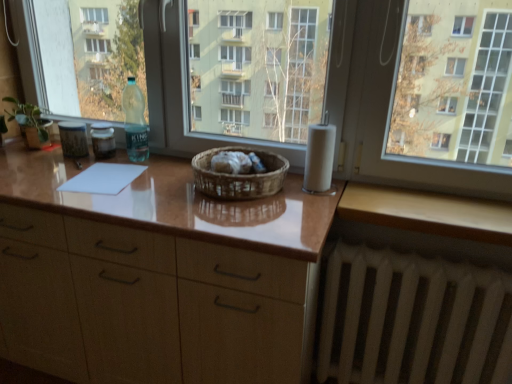
Question: Should I look upward or downward to see woven brown basket at center?

Choices:
 (A) down
 (B) up

Answer: (B)

Question: From a real-world perspective, is white matte toilet paper at right beneath green matte plant at left?

Choices:
 (A) no
 (B) yes

Answer: (B)

Question: Can you confirm if white matte toilet paper at right is wider than green matte plant at left?

Choices:
 (A) yes
 (B) no

Answer: (B)

Question: Would you say white matte toilet paper at right is a long distance from green matte plant at left?

Choices:
 (A) yes
 (B) no

Answer: (A)

Question: From a real-world perspective, is white matte toilet paper at right physically above green matte plant at left?

Choices:
 (A) no
 (B) yes

Answer: (A)

Question: Can you confirm if white matte toilet paper at right is positioned to the right of green matte plant at left?

Choices:
 (A) no
 (B) yes

Answer: (B)

Question: Is green matte plant at left surrounded by white matte toilet paper at right?

Choices:
 (A) yes
 (B) no

Answer: (B)

Question: Considering the relative sizes of white matte toilet paper at right and white matte radiator at lower right in the image provided, is white matte toilet paper at right taller than white matte radiator at lower right?

Choices:
 (A) no
 (B) yes

Answer: (A)

Question: Is white matte toilet paper at right positioned before white matte radiator at lower right?

Choices:
 (A) yes
 (B) no

Answer: (B)

Question: Is white matte toilet paper at right far from white matte radiator at lower right?

Choices:
 (A) no
 (B) yes

Answer: (A)

Question: Is white matte toilet paper at right positioned behind white matte radiator at lower right?

Choices:
 (A) yes
 (B) no

Answer: (A)

Question: Is white matte toilet paper at right directly adjacent to white matte radiator at lower right?

Choices:
 (A) yes
 (B) no

Answer: (B)

Question: Does white matte toilet paper at right have a larger size compared to white matte radiator at lower right?

Choices:
 (A) yes
 (B) no

Answer: (B)

Question: From the image's perspective, is green matte plant at left located above wooden at lower right?

Choices:
 (A) no
 (B) yes

Answer: (B)